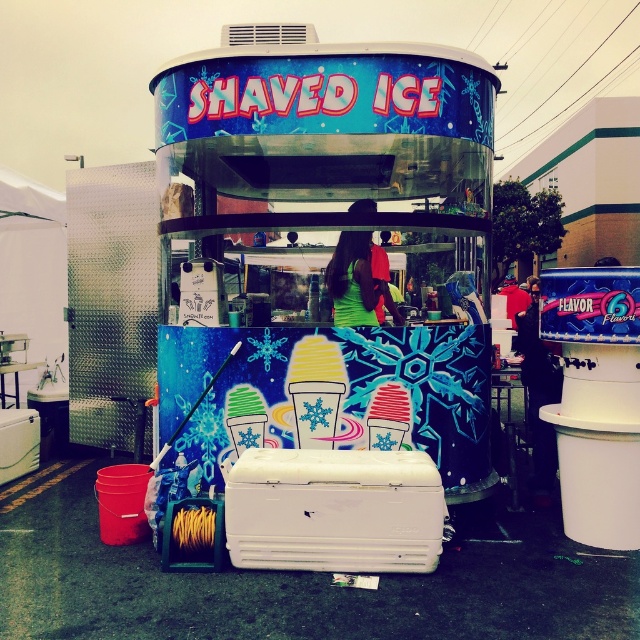
Is white plastic cooler at center taller than green matte shirt at center?

In fact, white plastic cooler at center may be shorter than green matte shirt at center.

Between white plastic cooler at center and green matte shirt at center, which one is positioned higher?

green matte shirt at center

Is point (257, 515) less distant than point (381, 250)?

Yes.

Locate an element on the screen. The width and height of the screenshot is (640, 640). white plastic cooler at center is located at coordinates (333, 509).

Can you confirm if shiny metallic shaved ice cart at center is bigger than white plastic cooler at center?

Yes, shiny metallic shaved ice cart at center is bigger than white plastic cooler at center.

Who is positioned more to the right, shiny metallic shaved ice cart at center or white plastic cooler at center?

shiny metallic shaved ice cart at center is more to the right.

You are a GUI agent. You are given a task and a screenshot of the screen. Output one action in this format:
    pyautogui.click(x=<x>, y=<y>)
    Task: Click on the shiny metallic shaved ice cart at center
    
    Given the screenshot: What is the action you would take?
    pyautogui.click(x=323, y=246)

Does shiny metallic shaved ice cart at center appear under green matte shirt at center?

Indeed, shiny metallic shaved ice cart at center is positioned under green matte shirt at center.

Which is below, shiny metallic shaved ice cart at center or green matte shirt at center?

shiny metallic shaved ice cart at center is lower down.

Locate an element on the screen. The height and width of the screenshot is (640, 640). shiny metallic shaved ice cart at center is located at coordinates (323, 246).